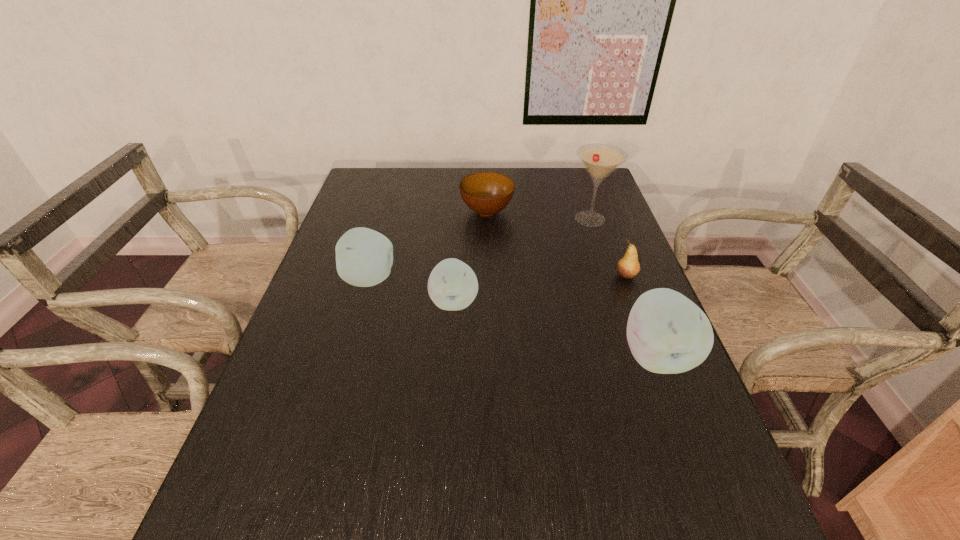
The height and width of the screenshot is (540, 960). I want to click on vacant position for inserting another apple evenly, so click(549, 327).